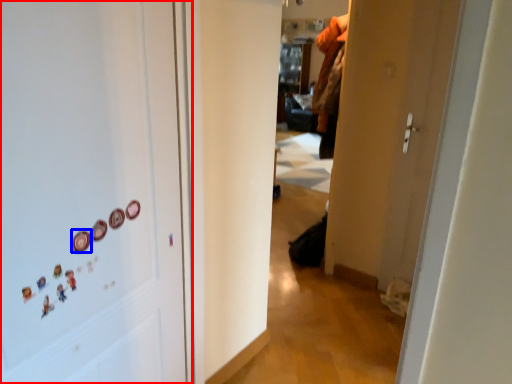
Question: Among these objects, which one is nearest to the camera, door (highlighted by a red box) or button (highlighted by a blue box)?

Choices:
 (A) door
 (B) button

Answer: (A)